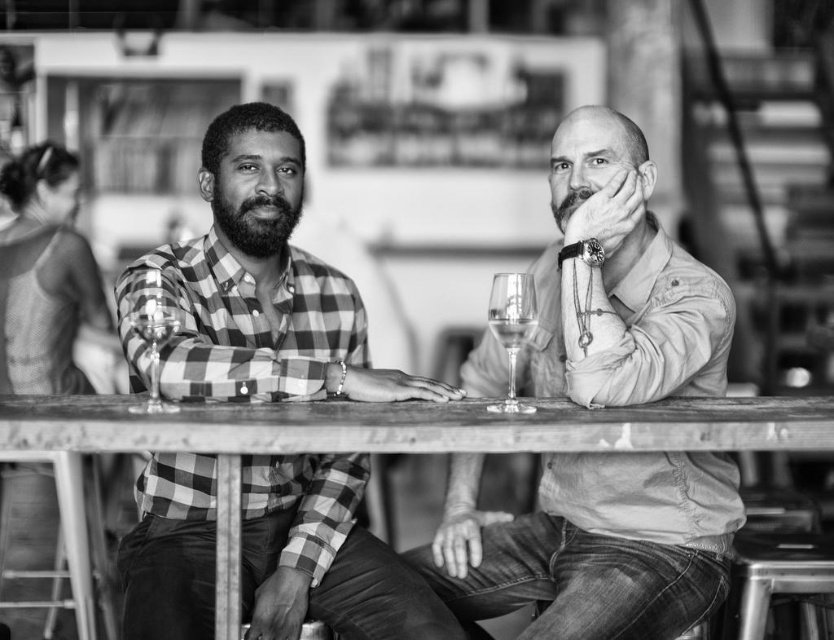
Is checkered fabric shirt at center wider than wooden table at center?

Incorrect, checkered fabric shirt at center's width does not surpass wooden table at center's.

Can you confirm if checkered fabric shirt at center is positioned to the right of wooden table at center?

Incorrect, checkered fabric shirt at center is not on the right side of wooden table at center.

Where is `checkered fabric shirt at center`? Image resolution: width=834 pixels, height=640 pixels. checkered fabric shirt at center is located at coordinates (257, 285).

Image resolution: width=834 pixels, height=640 pixels. Find the location of `checkered fabric shirt at center`. checkered fabric shirt at center is located at coordinates (257, 285).

Does wooden table at center lie in front of clear glass wine glass at center?

Yes.

Does wooden table at center have a smaller size compared to clear glass wine glass at center?

Incorrect, wooden table at center is not smaller in size than clear glass wine glass at center.

Is point (827, 406) behind point (496, 278)?

Yes, it is behind point (496, 278).

You are a GUI agent. You are given a task and a screenshot of the screen. Output one action in this format:
    pyautogui.click(x=<x>, y=<y>)
    Task: Click on the wooden table at center
    The height and width of the screenshot is (640, 834).
    Given the screenshot: What is the action you would take?
    pyautogui.click(x=369, y=444)

Between wooden table at center and clear glass at center, which one has more height?

Standing taller between the two is wooden table at center.

The width and height of the screenshot is (834, 640). I want to click on wooden table at center, so click(x=369, y=444).

Locate an element on the screen. The width and height of the screenshot is (834, 640). wooden table at center is located at coordinates (369, 444).

Locate an element on the screen. The image size is (834, 640). wooden table at center is located at coordinates (369, 444).